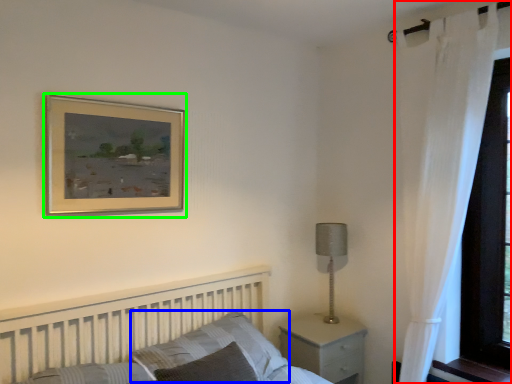
Question: Which object is the farthest from curtain (highlighted by a red box)? Choose among these: pillow (highlighted by a blue box) or picture frame (highlighted by a green box).

Choices:
 (A) pillow
 (B) picture frame

Answer: (B)